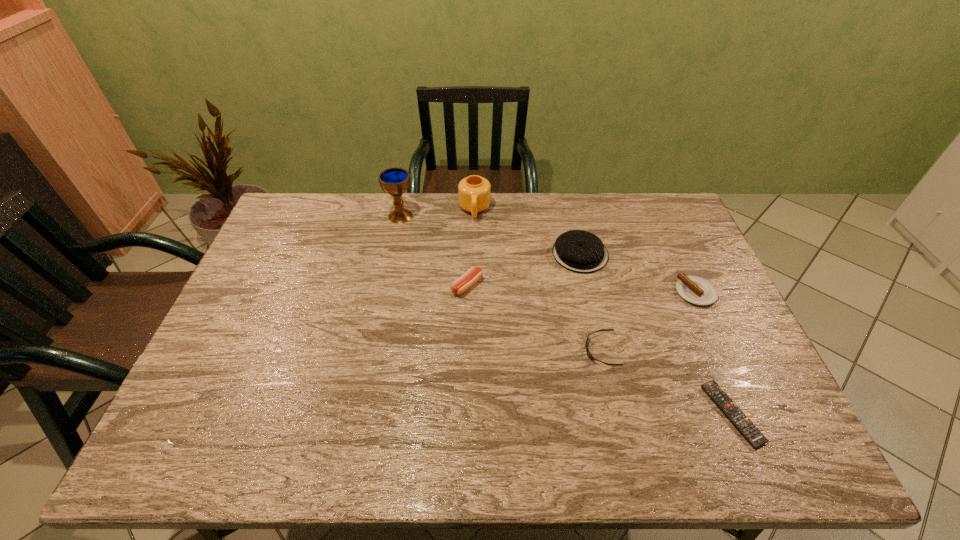
Where is `vacant space that's between the sunglasses and the left sausage`? This screenshot has width=960, height=540. vacant space that's between the sunglasses and the left sausage is located at coordinates tap(534, 318).

Locate an element on the screen. free area in between the tallest object and the third shortest object is located at coordinates [548, 254].

Identify the location of blank region between the tallest object and the sixth farthest object. The image size is (960, 540). (501, 283).

Locate an element on the screen. The image size is (960, 540). the sixth closest object relative to the pancake is located at coordinates (395, 181).

Choose which object is the fourth nearest neighbor to the tallest object. Please provide its 2D coordinates. Your answer should be formatted as a tuple, i.e. [(x, y)], where the tuple contains the x and y coordinates of a point satisfying the conditions above.

[(589, 354)]

I want to click on free region that satisfies the following two spatial constraints: 1. on the front side of the shorter sausage; 2. on the front-facing side of the second nearest object, so click(722, 350).

Image resolution: width=960 pixels, height=540 pixels. What are the coordinates of `vacant region that satisfies the following two spatial constraints: 1. on the front side of the tallest object; 2. on the right side of the right sausage` in the screenshot? It's located at (385, 292).

Find the location of `vacant position in the image that satisfies the following two spatial constraints: 1. on the handle side of the fifth shortest object; 2. on the left side of the mug`. vacant position in the image that satisfies the following two spatial constraints: 1. on the handle side of the fifth shortest object; 2. on the left side of the mug is located at coordinates (474, 254).